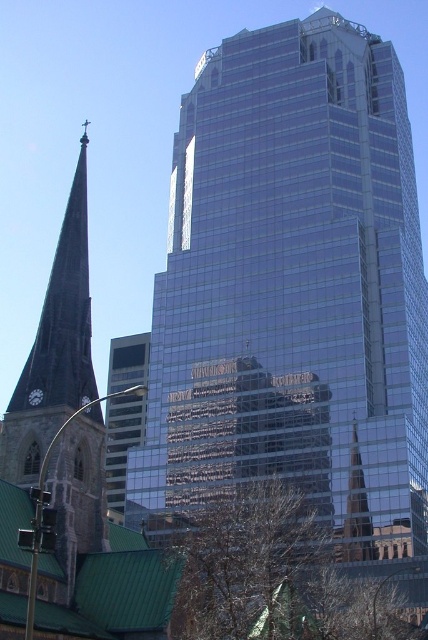
Question: Which of the following is the farthest from the observer?

Choices:
 (A) tap(416, 436)
 (B) tap(357, 444)

Answer: (A)

Question: Which object is closer to the camera taking this photo?

Choices:
 (A) clear glass skyscraper at center
 (B) shiny glass spire at center

Answer: (A)

Question: Where is clear glass skyscraper at center located in relation to shiny glass spire at center in the image?

Choices:
 (A) below
 (B) above

Answer: (A)

Question: Can you confirm if clear glass skyscraper at center is positioned to the right of shiny glass spire at center?

Choices:
 (A) yes
 (B) no

Answer: (B)

Question: Where is clear glass skyscraper at center located in relation to shiny glass spire at center in the image?

Choices:
 (A) below
 (B) above

Answer: (A)

Question: Estimate the real-world distances between objects in this image. Which object is farther from the clear glass skyscraper at center?

Choices:
 (A) shiny glass spire at center
 (B) transparent glass skyscraper at center

Answer: (A)